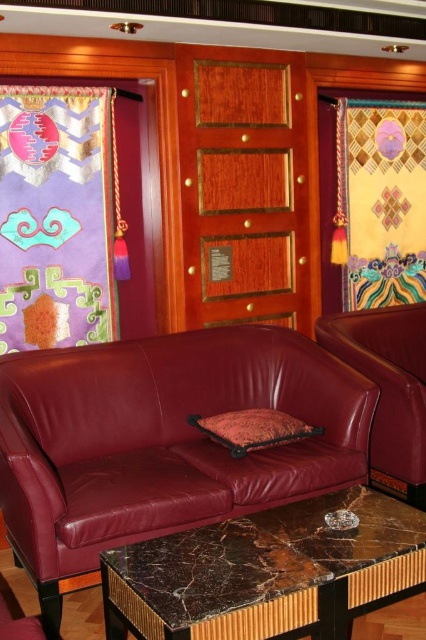
Looking at this image, is leather at right below velvet-like orange pillow at center?

No, leather at right is not below velvet-like orange pillow at center.

Is leather at right wider than velvet-like orange pillow at center?

Yes.

Which is in front, point (394, 314) or point (213, 426)?

Point (213, 426) is in front.

Locate an element on the screen. leather at right is located at coordinates (388, 388).

Is point (356, 404) behind point (374, 449)?

No.

Does burgundy leather couch at center have a lesser width compared to leather at right?

Incorrect, burgundy leather couch at center's width is not less than leather at right's.

This screenshot has height=640, width=426. Identify the location of burgundy leather couch at center. [x=163, y=440].

Can you confirm if marble/stone coffee table at center is smaller than leather at right?

Indeed, marble/stone coffee table at center has a smaller size compared to leather at right.

Is point (339, 536) farther from camera compared to point (423, 481)?

No, (339, 536) is in front of (423, 481).

Does point (192, 595) lie in front of point (367, 336)?

Yes, point (192, 595) is in front of point (367, 336).

The height and width of the screenshot is (640, 426). Identify the location of marble/stone coffee table at center. (267, 572).